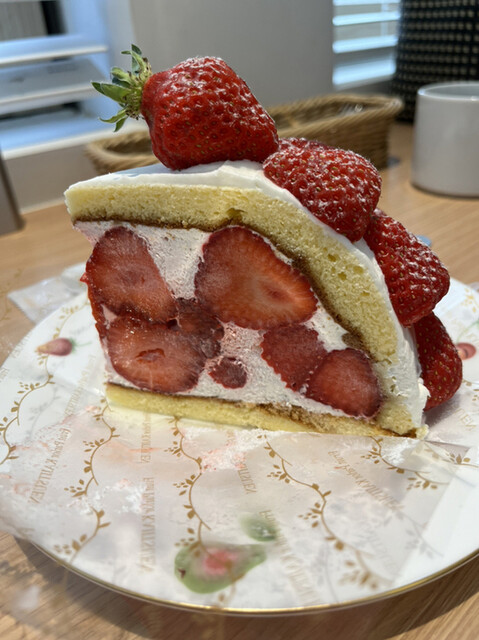
Find the location of a particular element. The image size is (479, 640). coffee mug is located at coordinates (451, 128).